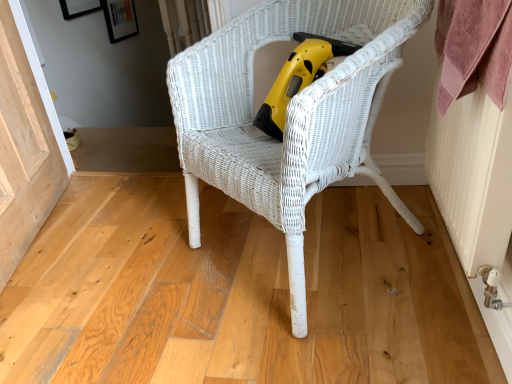
Question: From a real-world perspective, is white wicker chair at center physically below natural wood screen door at lower left?

Choices:
 (A) no
 (B) yes

Answer: (A)

Question: Considering the relative positions of white wicker chair at center and natural wood screen door at lower left in the image provided, is white wicker chair at center to the right of natural wood screen door at lower left from the viewer's perspective?

Choices:
 (A) no
 (B) yes

Answer: (B)

Question: Does white wicker chair at center have a greater width compared to natural wood screen door at lower left?

Choices:
 (A) no
 (B) yes

Answer: (B)

Question: Is white wicker chair at center bigger than natural wood screen door at lower left?

Choices:
 (A) yes
 (B) no

Answer: (A)

Question: Is white wicker chair at center looking in the opposite direction of natural wood screen door at lower left?

Choices:
 (A) yes
 (B) no

Answer: (B)

Question: Is white wicker chair at center taller than natural wood screen door at lower left?

Choices:
 (A) yes
 (B) no

Answer: (A)

Question: From the image's perspective, would you say white wicker chair at center is shown under yellow plastic vacuum at center?

Choices:
 (A) yes
 (B) no

Answer: (A)

Question: From the image's perspective, is white wicker chair at center located above yellow plastic vacuum at center?

Choices:
 (A) no
 (B) yes

Answer: (A)

Question: Does white wicker chair at center have a greater width compared to yellow plastic vacuum at center?

Choices:
 (A) yes
 (B) no

Answer: (A)

Question: From a real-world perspective, does white wicker chair at center stand above yellow plastic vacuum at center?

Choices:
 (A) no
 (B) yes

Answer: (A)

Question: Is white wicker chair at center located outside yellow plastic vacuum at center?

Choices:
 (A) no
 (B) yes

Answer: (B)

Question: Is yellow plastic vacuum at center a part of white wicker chair at center?

Choices:
 (A) no
 (B) yes

Answer: (B)

Question: Is natural wood screen door at lower left facing towards white wicker chair at center?

Choices:
 (A) no
 (B) yes

Answer: (B)